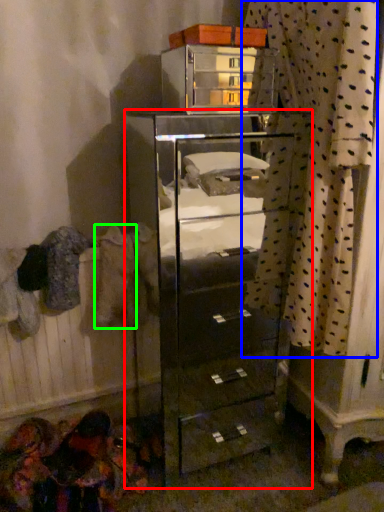
Question: Considering the real-world distances, which object is closest to chest of drawers (highlighted by a red box)? curtain (highlighted by a blue box) or clothing (highlighted by a green box).

Choices:
 (A) curtain
 (B) clothing

Answer: (A)